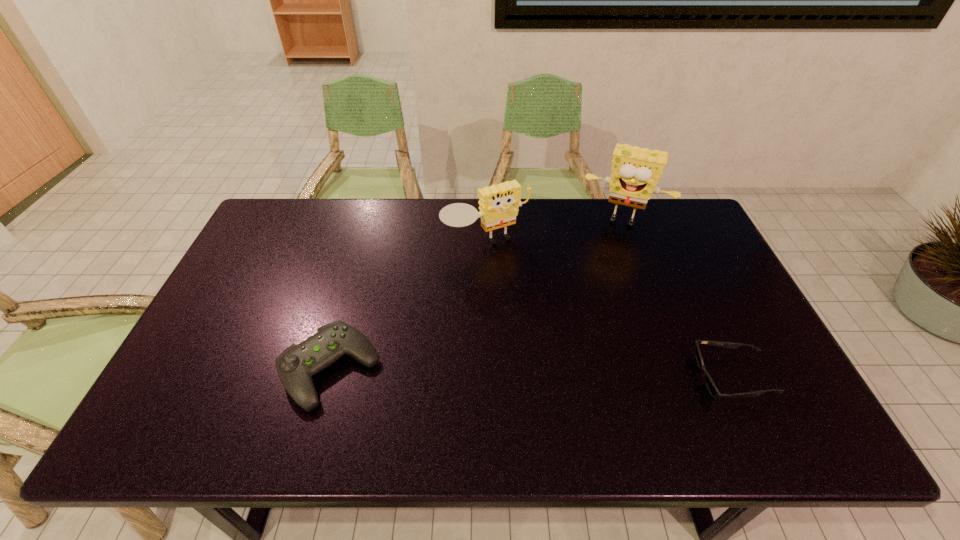
At what (x,y) coordinates should I click in order to perform the action: click on free space on the desktop that is between the control and the shortest object and is positioned on the front-facing side of the third object from right to left. Please return your answer as a coordinate pair (x, y). Looking at the image, I should click on (579, 374).

Where is `vacant space on the desktop that is between the leftmost object and the sunglasses and is positioned on the front-facing side of the tallest object`? Image resolution: width=960 pixels, height=540 pixels. vacant space on the desktop that is between the leftmost object and the sunglasses and is positioned on the front-facing side of the tallest object is located at coordinates (578, 374).